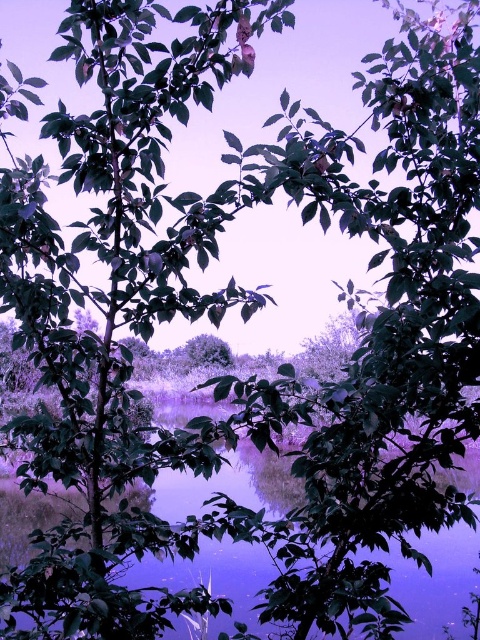
Is point (187, 404) behind point (225, 348)?

Yes.

You are a GUI agent. You are given a task and a screenshot of the screen. Output one action in this format:
    pyautogui.click(x=<x>, y=<y>)
    Task: Click on the purple reflective water at center
    This screenshot has height=640, width=480.
    Given the screenshot: What is the action you would take?
    pyautogui.click(x=276, y=481)